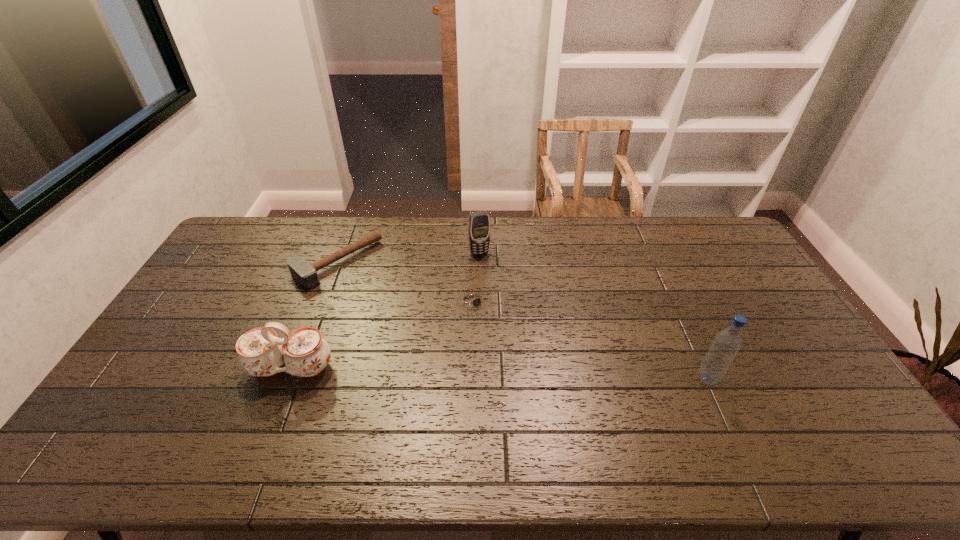
Where is `vacant area situated 0.270m on the striking surface of the hammer`? vacant area situated 0.270m on the striking surface of the hammer is located at coordinates (410, 324).

Image resolution: width=960 pixels, height=540 pixels. What are the coordinates of `vacant space located 0.340m on the striking surface of the hammer` in the screenshot? It's located at point(424,336).

I want to click on vacant space located on the striking surface of the hammer, so click(x=384, y=303).

Locate an element on the screen. This screenshot has height=540, width=960. vacant space located on the front face of the cellular telephone is located at coordinates (494, 282).

Locate an element on the screen. The width and height of the screenshot is (960, 540). vacant space located on the front face of the cellular telephone is located at coordinates (503, 300).

At what (x,y) coordinates should I click in order to perform the action: click on free space located on the front face of the cellular telephone. Please return your answer as a coordinate pair (x, y). The image size is (960, 540). Looking at the image, I should click on coord(488,268).

Image resolution: width=960 pixels, height=540 pixels. In order to click on hammer that is at the far edge in this screenshot , I will do `click(305, 274)`.

This screenshot has height=540, width=960. In order to click on cellular telephone that is positioned at the far edge in this screenshot , I will do `click(479, 222)`.

Identify the location of vacant region at the far edge of the desktop. This screenshot has height=540, width=960. (620, 249).

At what (x,y) coordinates should I click in order to perform the action: click on free space at the near edge of the desktop. Please return your answer as a coordinate pair (x, y). This screenshot has height=540, width=960. Looking at the image, I should click on (267, 415).